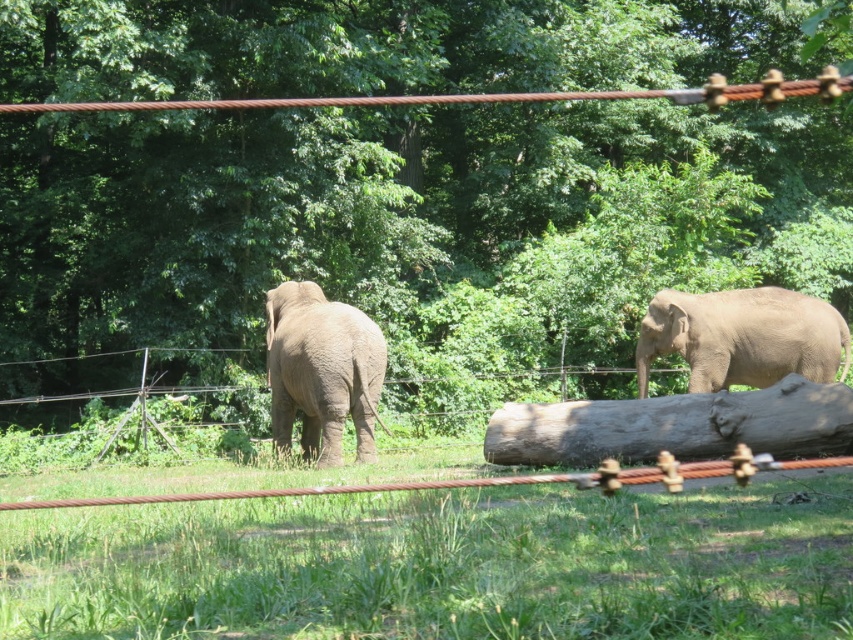
Question: Among these points, which one is nearest to the camera?

Choices:
 (A) (668, 292)
 (B) (334, 618)
 (C) (614, 454)
 (D) (306, 320)

Answer: (B)

Question: Where is green leafy tree at center located in relation to gray rough log at center in the image?

Choices:
 (A) above
 (B) below

Answer: (A)

Question: Which of the following is the closest to the observer?

Choices:
 (A) gray rough log at center
 (B) green leafy tree at center
 (C) gray matte elephant at right
 (D) green grass at lower center

Answer: (B)

Question: Is green grass at lower center further to the viewer compared to gray matte elephant at right?

Choices:
 (A) yes
 (B) no

Answer: (B)

Question: Considering the real-world distances, which object is closest to the green leafy tree at center?

Choices:
 (A) gray matte elephant at right
 (B) green grass at lower center
 (C) gray matte elephant at center

Answer: (C)

Question: Is green leafy tree at center smaller than gray matte elephant at center?

Choices:
 (A) no
 (B) yes

Answer: (A)